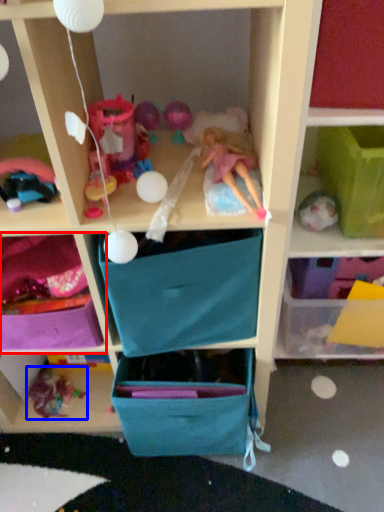
Question: Which object appears closest to the camera in this image, shelf (highlighted by a red box) or toy (highlighted by a blue box)?

Choices:
 (A) shelf
 (B) toy

Answer: (A)